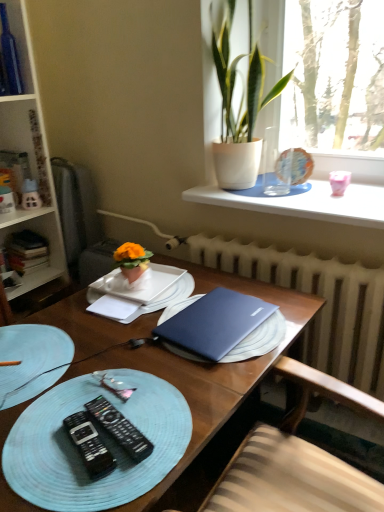
Where is `spots to the right of matte orange flowerpot at center, which is the second houseplant in top-to-bottom order`? This screenshot has width=384, height=512. spots to the right of matte orange flowerpot at center, which is the second houseplant in top-to-bottom order is located at coordinates (165, 282).